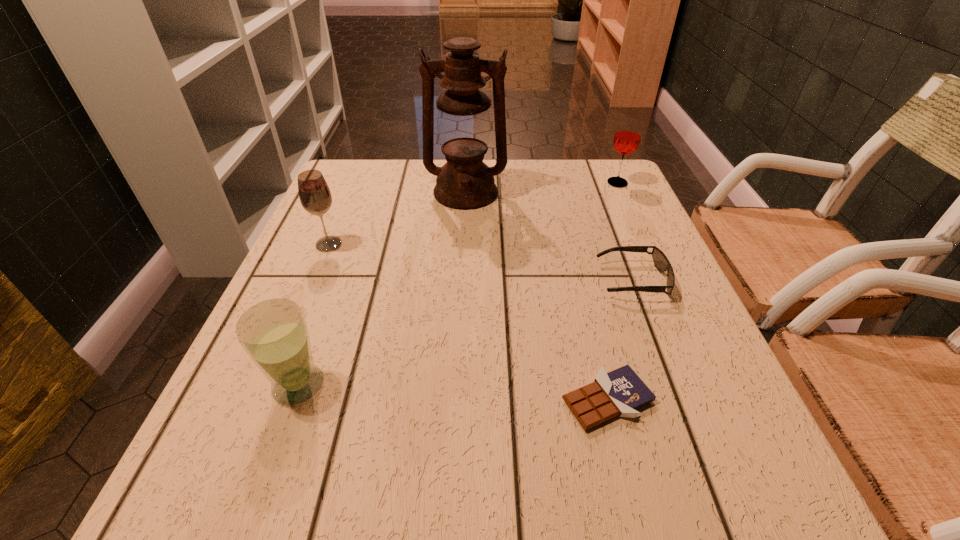
Identify the location of vacant space located on the left of the rightmost glass. (488, 183).

You are a GUI agent. You are given a task and a screenshot of the screen. Output one action in this format:
    pyautogui.click(x=<x>, y=<y>)
    Task: Click on the vacant space situated on the back of the nearest glass
    This screenshot has width=960, height=540.
    Given the screenshot: What is the action you would take?
    pyautogui.click(x=339, y=274)

This screenshot has height=540, width=960. Find the location of `free location located 0.050m on the front-facing side of the second shortest object`. free location located 0.050m on the front-facing side of the second shortest object is located at coordinates (575, 280).

Where is `vacant space situated on the front-facing side of the second shortest object`? vacant space situated on the front-facing side of the second shortest object is located at coordinates (575, 280).

You are a GUI agent. You are given a task and a screenshot of the screen. Output one action in this format:
    pyautogui.click(x=<x>, y=<y>)
    Task: Click on the free spot located on the front-facing side of the second shortest object
    This screenshot has width=960, height=540.
    Given the screenshot: What is the action you would take?
    pyautogui.click(x=507, y=280)

Where is `vacant space located on the back of the chocolate bar`? vacant space located on the back of the chocolate bar is located at coordinates pyautogui.click(x=573, y=260).

Find the location of a particular element. oil lamp positioned at the far edge is located at coordinates (465, 182).

In order to click on glass present at the far edge in this screenshot , I will do `click(627, 137)`.

The width and height of the screenshot is (960, 540). I want to click on glass present at the right edge, so click(627, 137).

Where is `sunglasses that is at the right edge`? This screenshot has width=960, height=540. sunglasses that is at the right edge is located at coordinates (661, 262).